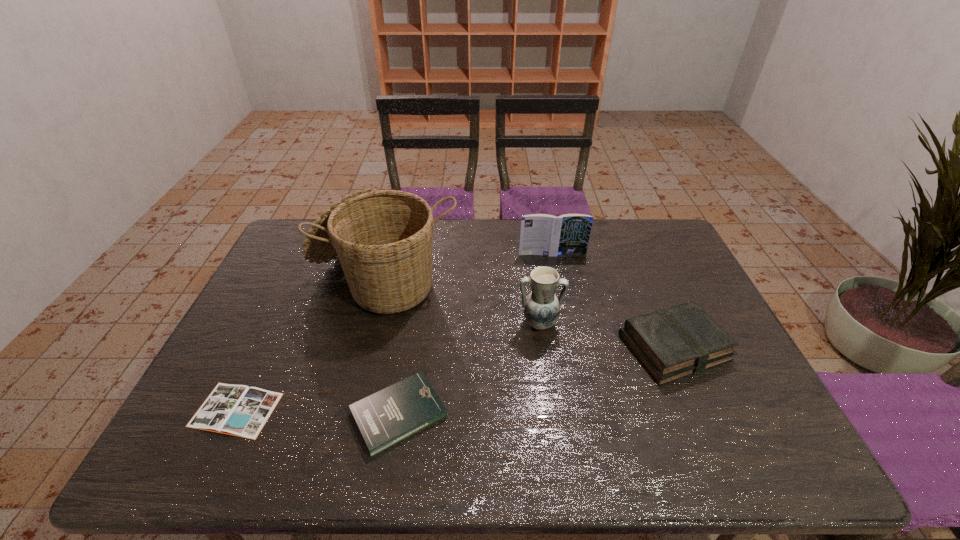
Select which book is the closest to the third shortest object. Please provide its 2D coordinates. Your answer should be formatted as a tuple, i.e. [(x, y)], where the tuple contains the x and y coordinates of a point satisfying the conditions above.

[(541, 234)]